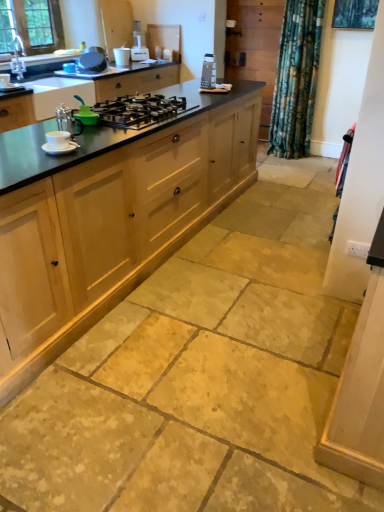
I want to click on vacant space that is in between natural wood cabinetry at center and white glossy screen door at right, so click(x=229, y=286).